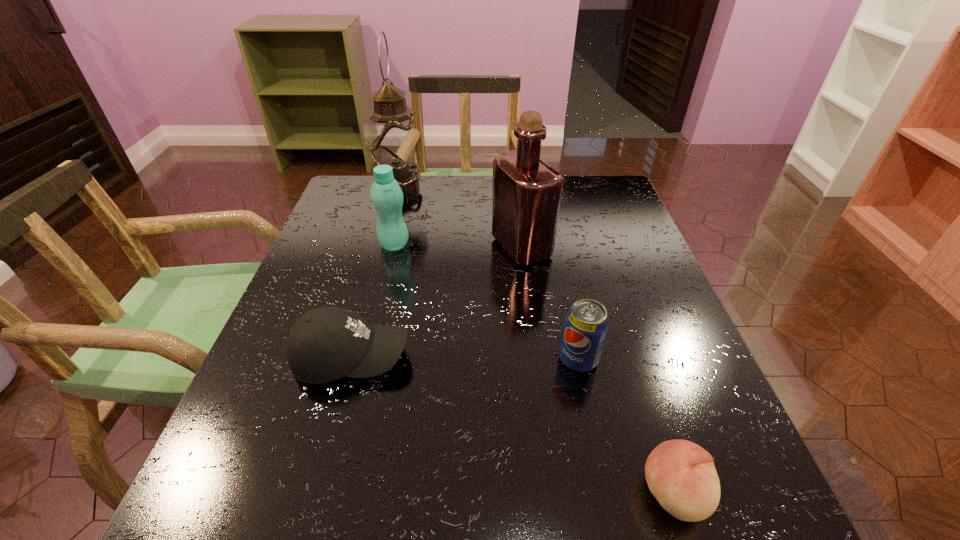
In order to click on vacant space located on the front of the third tallest object in this screenshot , I will do (x=378, y=312).

Where is `free space located on the front of the soda`? The width and height of the screenshot is (960, 540). free space located on the front of the soda is located at coordinates (603, 476).

What are the coordinates of `vacant area situated on the front-facing side of the fifth tallest object` in the screenshot? It's located at (573, 358).

Find the location of a particular element. This screenshot has width=960, height=540. free region located 0.070m on the right of the peach is located at coordinates (756, 494).

Locate an element on the screen. The height and width of the screenshot is (540, 960). object at the far edge is located at coordinates (394, 141).

Find the location of a particular element. The width and height of the screenshot is (960, 540). object that is at the near edge is located at coordinates (681, 475).

Find the location of a particular element. oil lamp that is at the left edge is located at coordinates (394, 141).

Where is `bottle that is at the left edge`? The height and width of the screenshot is (540, 960). bottle that is at the left edge is located at coordinates (387, 197).

This screenshot has width=960, height=540. I want to click on baseball cap that is at the left edge, so click(325, 344).

You are a GUI agent. You are given a task and a screenshot of the screen. Output one action in this format:
    pyautogui.click(x=<x>, y=<y>)
    Task: Click on the object present at the right edge
    
    Given the screenshot: What is the action you would take?
    pyautogui.click(x=681, y=475)